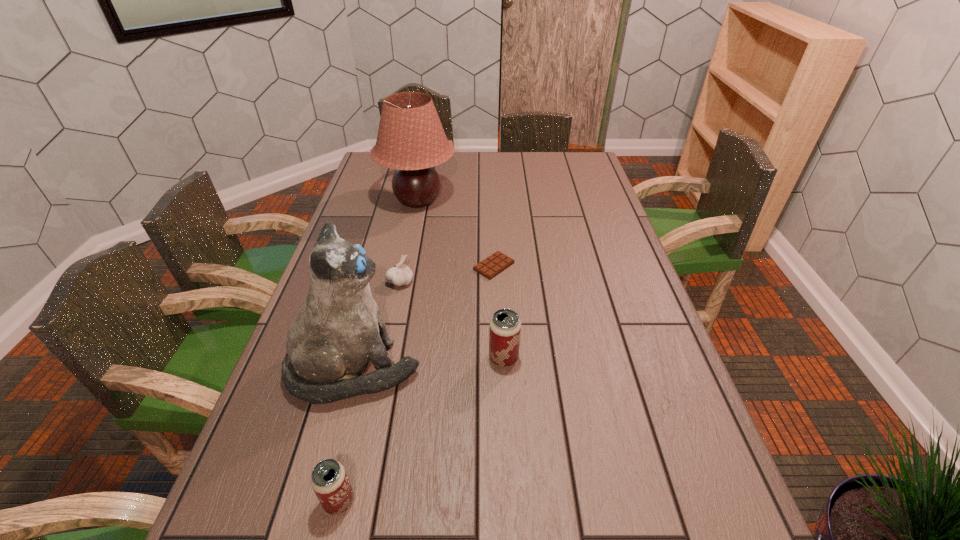
I want to click on free space for a new beer can on the right, so click(606, 269).